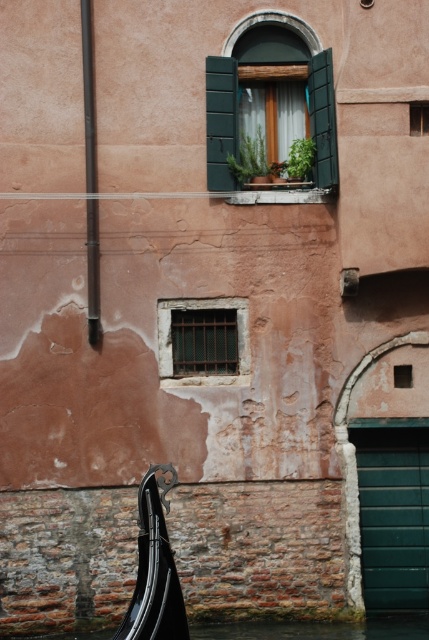
Question: Among these objects, which one is nearest to the camera?

Choices:
 (A) green matte shutter at lower right
 (B) matte green window at center

Answer: (B)

Question: Which point appears closest to the camera in this image?

Choices:
 (A) [208, 163]
 (B) [91, 316]

Answer: (B)

Question: Can you confirm if green matte shutter at lower right is positioned above transparent water at lower left?

Choices:
 (A) yes
 (B) no

Answer: (A)

Question: Can you confirm if rusty metal window at center is thinner than matte green window at center?

Choices:
 (A) no
 (B) yes

Answer: (A)

Question: Which of the following is the closest to the observer?

Choices:
 (A) (244, 333)
 (B) (277, 20)

Answer: (A)

Question: Is rusty metal window at center above matte green window at center?

Choices:
 (A) yes
 (B) no

Answer: (B)